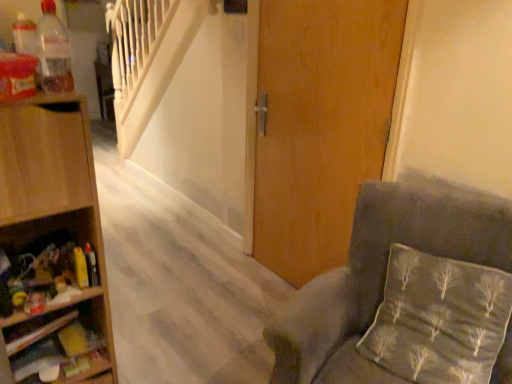
Measure the distance between point (91, 339) and camera.

Point (91, 339) is 1.38 meters away from camera.

Image resolution: width=512 pixels, height=384 pixels. Describe the element at coordinates (54, 51) in the screenshot. I see `transparent plastic bottle at upper left` at that location.

Locate an element on the screen. This screenshot has height=384, width=512. silky gray pillow at lower right is located at coordinates (440, 320).

You are a GUI agent. You are given a task and a screenshot of the screen. Output one action in this format:
    pyautogui.click(x=<x>, y=<y>)
    Task: Click on the velvet grey chair at lower right
    The height and width of the screenshot is (384, 512).
    Given the screenshot: What is the action you would take?
    pyautogui.click(x=385, y=261)

Where is `wooden shelves at lower left, the 1th shelf from the bottom`? This screenshot has width=512, height=384. wooden shelves at lower left, the 1th shelf from the bottom is located at coordinates (60, 343).

Which is behind, point (383, 25) or point (13, 237)?

Point (383, 25)

Can you confirm if wooden door at center is thinner than wooden shelf at left, positioned as the first shelf in top-to-bottom order?

Correct, the width of wooden door at center is less than that of wooden shelf at left, positioned as the first shelf in top-to-bottom order.

From a real-world perspective, is wooden door at center positioned above or below wooden shelf at left, positioned as the first shelf in top-to-bottom order?

From a real-world perspective, wooden door at center is physically above wooden shelf at left, positioned as the first shelf in top-to-bottom order.

In the scene shown: From the image's perspective, is wooden door at center located above or below wooden shelf at left, the 2th shelf in the bottom-to-top sequence?

Based on their image positions, wooden door at center is located above wooden shelf at left, the 2th shelf in the bottom-to-top sequence.

Considering the relative sizes of transparent plastic bottle at upper left and wooden shelf at left, the 2th shelf in the bottom-to-top sequence, in the image provided, is transparent plastic bottle at upper left shorter than wooden shelf at left, the 2th shelf in the bottom-to-top sequence,?

Correct, transparent plastic bottle at upper left is not as tall as wooden shelf at left, the 2th shelf in the bottom-to-top sequence.

Between point (38, 37) and point (85, 101), which one is positioned behind?

The point (85, 101) is farther from the camera.

Where is `bottle behind the wooden shelf at left, positioned as the first shelf in top-to-bottom order`? This screenshot has height=384, width=512. bottle behind the wooden shelf at left, positioned as the first shelf in top-to-bottom order is located at coordinates pos(54,51).

Can we say transparent plastic bottle at upper left lies outside wooden shelf at left, positioned as the first shelf in top-to-bottom order?

Yes, transparent plastic bottle at upper left is outside of wooden shelf at left, positioned as the first shelf in top-to-bottom order.

Can you confirm if wooden door at center is thinner than transparent plastic bottle at upper left?

No, wooden door at center is not thinner than transparent plastic bottle at upper left.

Which is further, (270, 251) or (57, 36)?

The point (270, 251) is behind.

Is wooden door at center positioned beyond the bounds of transparent plastic bottle at upper left?

That's correct, wooden door at center is outside of transparent plastic bottle at upper left.

Which is more to the left, silky gray pillow at lower right or wooden shelf at left, the 2th shelf in the bottom-to-top sequence?

wooden shelf at left, the 2th shelf in the bottom-to-top sequence.

Is silky gray pillow at lower right spatially inside wooden shelf at left, the 2th shelf in the bottom-to-top sequence, or outside of it?

silky gray pillow at lower right is spatially situated outside wooden shelf at left, the 2th shelf in the bottom-to-top sequence.

Is silky gray pillow at lower right wider than wooden shelf at left, the 2th shelf in the bottom-to-top sequence?

Incorrect, the width of silky gray pillow at lower right does not surpass that of wooden shelf at left, the 2th shelf in the bottom-to-top sequence.

Is silky gray pillow at lower right taller than wooden shelf at left, positioned as the first shelf in top-to-bottom order?

No, silky gray pillow at lower right is not taller than wooden shelf at left, positioned as the first shelf in top-to-bottom order.

Is wooden shelf at left, positioned as the first shelf in top-to-bottom order, to the left of wooden shelves at lower left, the 1th shelf from the bottom, from the viewer's perspective?

No.

Measure the distance from wooden shelf at left, the 2th shelf in the bottom-to-top sequence, to wooden shelves at lower left, which is counted as the 2th shelf, starting from the top.

The distance of wooden shelf at left, the 2th shelf in the bottom-to-top sequence, from wooden shelves at lower left, which is counted as the 2th shelf, starting from the top, is 5.32 inches.

How different are the orientations of wooden shelf at left, positioned as the first shelf in top-to-bottom order, and wooden shelves at lower left, the 1th shelf from the bottom, in degrees?

There is a 8.79-degree angle between the facing directions of wooden shelf at left, positioned as the first shelf in top-to-bottom order, and wooden shelves at lower left, the 1th shelf from the bottom.

Who is bigger, wooden shelf at left, the 2th shelf in the bottom-to-top sequence, or wooden shelves at lower left, which is counted as the 2th shelf, starting from the top?

With larger size is wooden shelf at left, the 2th shelf in the bottom-to-top sequence.

Does velvet grey chair at lower right turn towards wooden door at center?

No, velvet grey chair at lower right is not turned towards wooden door at center.

Does velvet grey chair at lower right appear on the left side of wooden door at center?

Incorrect, velvet grey chair at lower right is not on the left side of wooden door at center.

Is transparent plastic bottle at upper left wider than silky gray pillow at lower right?

In fact, transparent plastic bottle at upper left might be narrower than silky gray pillow at lower right.

Does transparent plastic bottle at upper left have a greater height compared to silky gray pillow at lower right?

Incorrect, the height of transparent plastic bottle at upper left is not larger of that of silky gray pillow at lower right.

From the image's perspective, is transparent plastic bottle at upper left above or below silky gray pillow at lower right?

transparent plastic bottle at upper left is situated higher than silky gray pillow at lower right in the image.

Where is `pillow below the transparent plastic bottle at upper left (from a real-world perspective)`? pillow below the transparent plastic bottle at upper left (from a real-world perspective) is located at coordinates (440, 320).

From the wooden door at center, count the 1st shelf to the left and point to it. Please provide its 2D coordinates.

[(54, 190)]

In order to click on shelf in front of the transparent plastic bottle at upper left in this screenshot , I will do `click(54, 190)`.

In the scene shown: Estimate the real-world distances between objects in this image. Which object is closer to silky gray pillow at lower right, wooden shelves at lower left, which is counted as the 2th shelf, starting from the top, or velvet grey chair at lower right?

Among the two, velvet grey chair at lower right is located nearer to silky gray pillow at lower right.

Based on their spatial positions, is wooden shelf at left, the 2th shelf in the bottom-to-top sequence, or silky gray pillow at lower right further from transparent plastic bottle at upper left?

silky gray pillow at lower right is positioned further to the anchor transparent plastic bottle at upper left.

Considering their positions, is wooden door at center positioned further to silky gray pillow at lower right than velvet grey chair at lower right?

wooden door at center is further to silky gray pillow at lower right.

Consider the image. Based on their spatial positions, is wooden door at center or transparent plastic bottle at upper left closer to velvet grey chair at lower right?

Among the two, wooden door at center is located nearer to velvet grey chair at lower right.

Considering their positions, is velvet grey chair at lower right positioned closer to wooden door at center than wooden shelf at left, the 2th shelf in the bottom-to-top sequence?

Based on the image, velvet grey chair at lower right appears to be nearer to wooden door at center.

Considering their positions, is transparent plastic bottle at upper left positioned closer to wooden door at center than velvet grey chair at lower right?

velvet grey chair at lower right is positioned closer to the anchor wooden door at center.

Estimate the real-world distances between objects in this image. Which object is further from wooden shelves at lower left, which is counted as the 2th shelf, starting from the top, wooden shelf at left, the 2th shelf in the bottom-to-top sequence, or silky gray pillow at lower right?

Among the two, silky gray pillow at lower right is located further to wooden shelves at lower left, which is counted as the 2th shelf, starting from the top.

Consider the image. Estimate the real-world distances between objects in this image. Which object is closer to wooden door at center, transparent plastic bottle at upper left or silky gray pillow at lower right?

silky gray pillow at lower right.

Locate an element on the screen. bottle between wooden shelf at left, the 2th shelf in the bottom-to-top sequence, and wooden door at center from left to right is located at coordinates (54, 51).

Locate an element on the screen. door between wooden shelves at lower left, which is counted as the 2th shelf, starting from the top, and silky gray pillow at lower right, in the horizontal direction is located at coordinates [x=319, y=125].

Identify the location of shelf between transparent plastic bottle at upper left and wooden shelves at lower left, the 1th shelf from the bottom, in the up-down direction. The width and height of the screenshot is (512, 384). (54, 190).

Where is `shelf situated between wooden shelves at lower left, which is counted as the 2th shelf, starting from the top, and wooden door at center from left to right`? shelf situated between wooden shelves at lower left, which is counted as the 2th shelf, starting from the top, and wooden door at center from left to right is located at coordinates (54, 190).